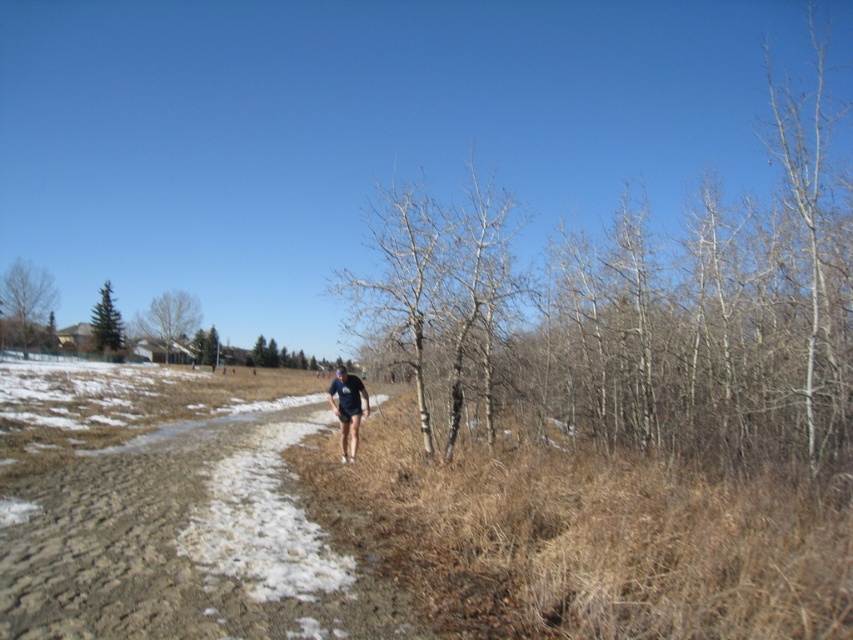
Question: Based on their relative distances, which object is nearer to the green matte evergreen tree at left?

Choices:
 (A) smooth brown tree at upper left
 (B) dark blue fabric at center
 (C) brown bark tree at left
 (D) smooth bark tree at center

Answer: (A)

Question: Does smooth bark tree at center appear on the right side of green matte evergreen tree at left?

Choices:
 (A) yes
 (B) no

Answer: (A)

Question: Can you confirm if brown bark tree at left is positioned to the left of smooth brown tree at upper left?

Choices:
 (A) yes
 (B) no

Answer: (A)

Question: Which of the following is the farthest from the observer?

Choices:
 (A) (33, 324)
 (B) (97, 330)
 (C) (361, 381)

Answer: (B)

Question: Which object is farther from the camera taking this photo?

Choices:
 (A) green matte evergreen tree at left
 (B) smooth bark tree at center
 (C) brown dirt track at center

Answer: (A)

Question: Does smooth brown tree at upper left appear under dark blue fabric at center?

Choices:
 (A) yes
 (B) no

Answer: (B)